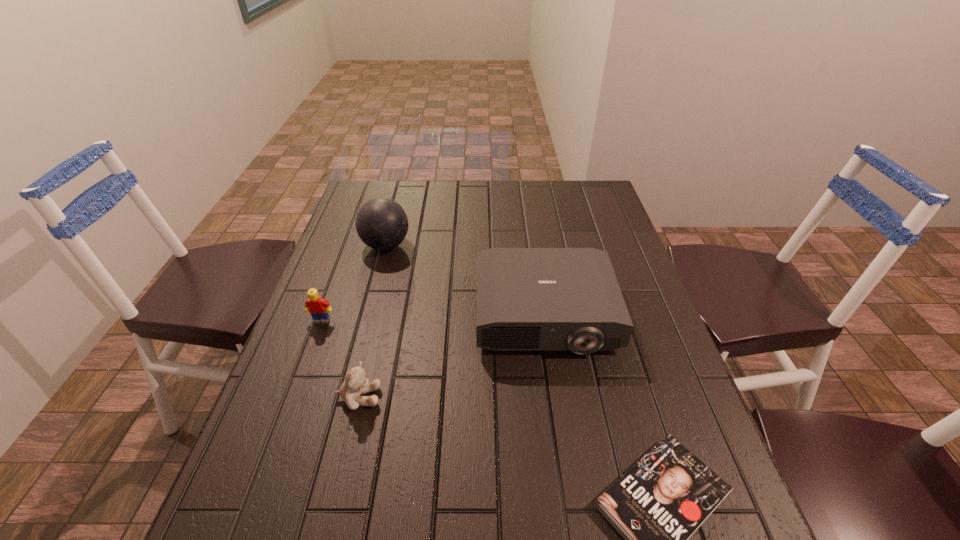
I want to click on free spot between the projector and the Lego, so click(x=433, y=318).

You are a GUI agent. You are given a task and a screenshot of the screen. Output one action in this format:
    pyautogui.click(x=<x>, y=<y>)
    Task: Click on the empty space that is in between the Lego and the projector
    The height and width of the screenshot is (540, 960).
    Given the screenshot: What is the action you would take?
    pyautogui.click(x=433, y=318)

Choose which object is the fourth nearest neighbor to the bowling ball. Please provide its 2D coordinates. Your answer should be formatted as a tuple, i.e. [(x, y)], where the tuple contains the x and y coordinates of a point satisfying the conditions above.

[(658, 504)]

Locate an element on the screen. The height and width of the screenshot is (540, 960). object that stands as the closest to the projector is located at coordinates (658, 504).

This screenshot has height=540, width=960. What are the coordinates of `free spot that satisfies the following two spatial constraints: 1. on the front-facing side of the projector; 2. on the face of the teddy bear` in the screenshot? It's located at (557, 397).

Locate an element on the screen. free space that satisfies the following two spatial constraints: 1. on the grip area of the farthest object; 2. on the front-facing side of the Lego is located at coordinates (366, 321).

Identify the location of vacant area in the image that satisfies the following two spatial constraints: 1. on the grip area of the tallest object; 2. on the front-facing side of the Lego. This screenshot has height=540, width=960. (366, 321).

Image resolution: width=960 pixels, height=540 pixels. Find the location of `blank area in the image that satisfies the following two spatial constraints: 1. on the front-facing side of the projector; 2. on the face of the fourth farthest object`. blank area in the image that satisfies the following two spatial constraints: 1. on the front-facing side of the projector; 2. on the face of the fourth farthest object is located at coordinates (557, 397).

What are the coordinates of `vacant space that satisfies the following two spatial constraints: 1. on the grip area of the bowling ball; 2. on the front-facing side of the leftmost object` in the screenshot? It's located at (366, 321).